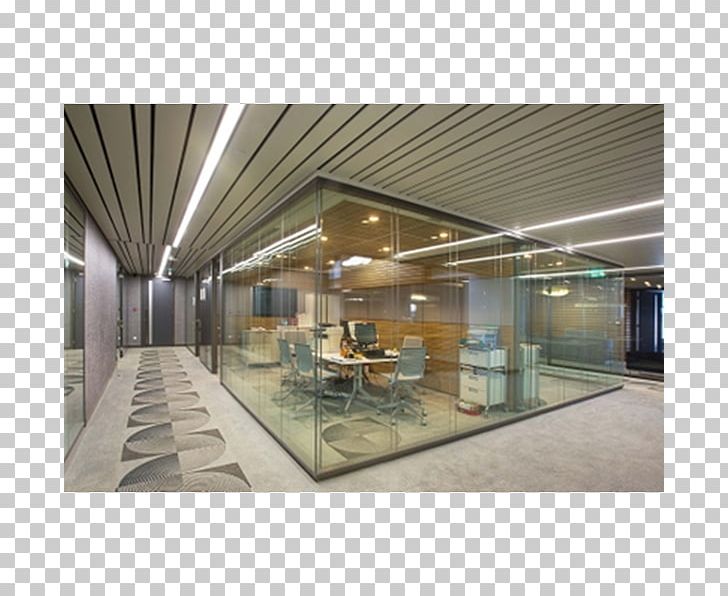
The image size is (728, 596). I want to click on table, so click(347, 360).